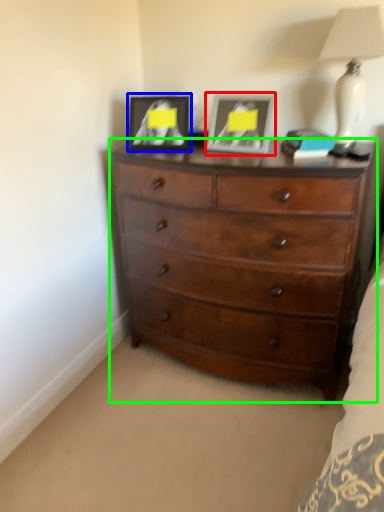
Question: Based on their relative distances, which object is nearer to picture frame (highlighted by a red box)? Choose from picture frame (highlighted by a blue box) and chest of drawers (highlighted by a green box).

Choices:
 (A) picture frame
 (B) chest of drawers

Answer: (A)